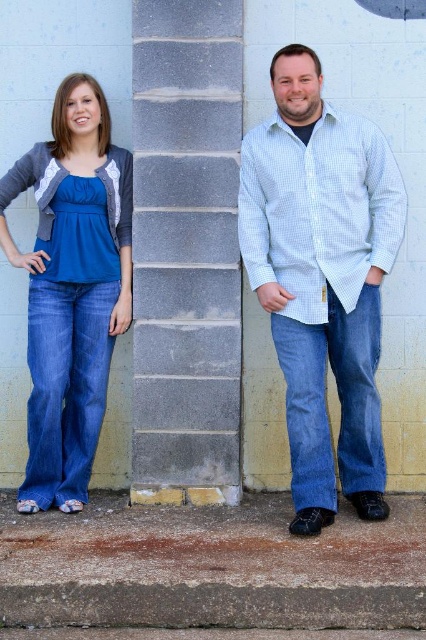
Who is lower down, gray concrete pillar at center or matte blue jeans at left?

matte blue jeans at left is below.

Is gray concrete pillar at center in front of matte blue jeans at left?

No, gray concrete pillar at center is further to the viewer.

Find the location of `gray concrete pillar at center`. gray concrete pillar at center is located at coordinates (186, 250).

Does gray concrete pillar at center have a greater width compared to blue denim jeans at center?

No, gray concrete pillar at center is not wider than blue denim jeans at center.

Consider the image. Who is higher up, gray concrete pillar at center or blue denim jeans at center?

gray concrete pillar at center is higher up.

Is point (157, 392) farther from viewer compared to point (37, 252)?

Yes, point (157, 392) is behind point (37, 252).

This screenshot has height=640, width=426. In order to click on gray concrete pillar at center in this screenshot , I will do `click(186, 250)`.

Is blue denim jeans at center to the left of matte blue jeans at left from the viewer's perspective?

No, blue denim jeans at center is not to the left of matte blue jeans at left.

You are a GUI agent. You are given a task and a screenshot of the screen. Output one action in this format:
    pyautogui.click(x=<x>, y=<y>)
    Task: Click on the blue denim jeans at center
    
    Given the screenshot: What is the action you would take?
    pyautogui.click(x=322, y=278)